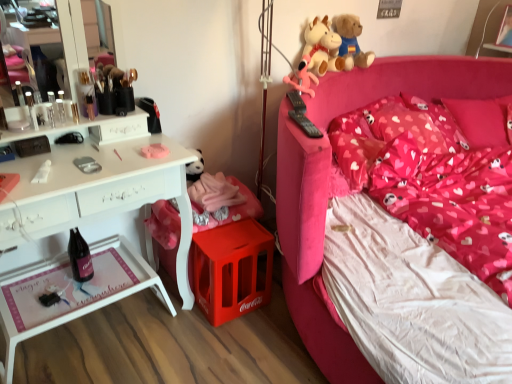
Question: From the image's perspective, would you say black glass bottle at lower left is positioned over matte pink plush at upper right, which appears as the first toy when viewed from the front?

Choices:
 (A) yes
 (B) no

Answer: (B)

Question: Can you confirm if black glass bottle at lower left is thinner than matte pink plush at upper right, which is counted as the 3th toy, starting from the back?

Choices:
 (A) yes
 (B) no

Answer: (A)

Question: From a real-world perspective, does black glass bottle at lower left sit lower than matte pink plush at upper right, which appears as the first toy when viewed from the front?

Choices:
 (A) yes
 (B) no

Answer: (A)

Question: Is matte pink plush at upper right, which is counted as the 3th toy, starting from the back, completely or partially inside black glass bottle at lower left?

Choices:
 (A) yes
 (B) no

Answer: (B)

Question: From the image's perspective, is black glass bottle at lower left below matte pink plush at upper right, which is counted as the 3th toy, starting from the back?

Choices:
 (A) yes
 (B) no

Answer: (A)

Question: Considering the positions of point (76, 253) and point (329, 64), is point (76, 253) closer or farther from the camera than point (329, 64)?

Choices:
 (A) closer
 (B) farther

Answer: (A)

Question: Considering the positions of black glass bottle at lower left and soft plush cow at upper right, which is the 2th toy from back to front, in the image, is black glass bottle at lower left taller or shorter than soft plush cow at upper right, which is the 2th toy from back to front,?

Choices:
 (A) tall
 (B) short

Answer: (A)

Question: Is black glass bottle at lower left inside the boundaries of soft plush cow at upper right, which ranks as the 2th toy in front-to-back order, or outside?

Choices:
 (A) outside
 (B) inside

Answer: (A)

Question: From a real-world perspective, is black glass bottle at lower left physically located above or below soft plush cow at upper right, which ranks as the 2th toy in front-to-back order?

Choices:
 (A) above
 (B) below

Answer: (B)

Question: In the image, is black glass bottle at lower left on the left side or the right side of soft plush toys at upper right, the 1th toy when ordered from back to front?

Choices:
 (A) right
 (B) left

Answer: (B)

Question: Considering their positions, is black glass bottle at lower left located in front of or behind soft plush toys at upper right, the 1th toy when ordered from back to front?

Choices:
 (A) behind
 (B) front

Answer: (B)

Question: In terms of size, does black glass bottle at lower left appear bigger or smaller than soft plush toys at upper right, the 1th toy when ordered from back to front?

Choices:
 (A) big
 (B) small

Answer: (B)

Question: Looking at their shapes, would you say black glass bottle at lower left is wider or thinner than soft plush toys at upper right, placed as the 3th toy when sorted from front to back?

Choices:
 (A) thin
 (B) wide

Answer: (A)

Question: From the image's perspective, is soft plush cow at upper right, which ranks as the 2th toy in front-to-back order, positioned above or below heart-patterned fabric pillow at upper right, which appears as the first pillow when viewed from the right?

Choices:
 (A) below
 (B) above

Answer: (B)

Question: Considering the positions of soft plush cow at upper right, which is the 2th toy from back to front, and heart-patterned fabric pillow at upper right, which appears as the first pillow when viewed from the right, in the image, is soft plush cow at upper right, which is the 2th toy from back to front, taller or shorter than heart-patterned fabric pillow at upper right, which appears as the first pillow when viewed from the right,?

Choices:
 (A) short
 (B) tall

Answer: (B)